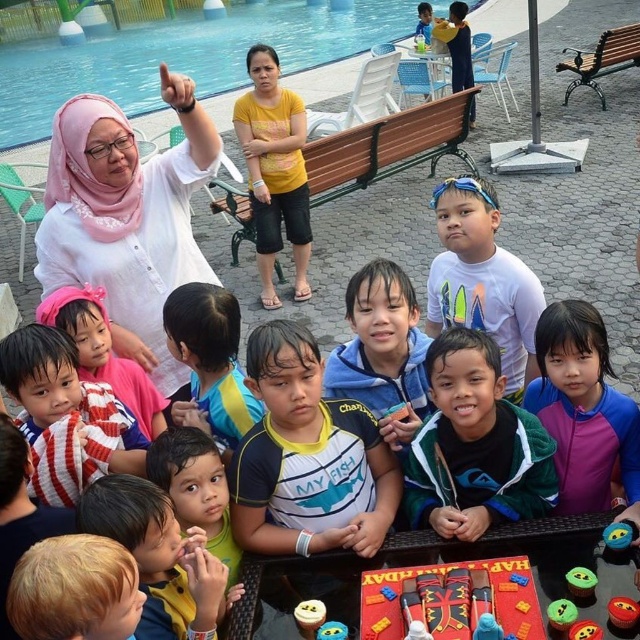
Between purple swimsuit at center and smooth plastic toy at lower right, which one is positioned lower?

smooth plastic toy at lower right

Does purple swimsuit at center appear on the left side of smooth plastic toy at lower right?

No, purple swimsuit at center is not to the left of smooth plastic toy at lower right.

The width and height of the screenshot is (640, 640). Describe the element at coordinates (582, 410) in the screenshot. I see `purple swimsuit at center` at that location.

Where is `purple swimsuit at center`? purple swimsuit at center is located at coordinates (582, 410).

How much distance is there between white matte swimwear at center and white matte shirt at center?

A distance of 1.38 meters exists between white matte swimwear at center and white matte shirt at center.

Looking at this image, is white matte swimwear at center taller than white matte shirt at center?

In fact, white matte swimwear at center may be shorter than white matte shirt at center.

Does point (237, 456) lie behind point (452, 182)?

No, (237, 456) is closer to viewer.

Locate an element on the screen. white matte swimwear at center is located at coordinates (307, 458).

Is black plastic table at center positioned behind smooth plastic cupcake at center?

Yes, black plastic table at center is behind smooth plastic cupcake at center.

Is black plastic table at center positioned in front of smooth plastic cupcake at center?

No, black plastic table at center is behind smooth plastic cupcake at center.

This screenshot has height=640, width=640. What do you see at coordinates (547, 529) in the screenshot?
I see `black plastic table at center` at bounding box center [547, 529].

Where is `black plastic table at center`? The image size is (640, 640). black plastic table at center is located at coordinates (547, 529).